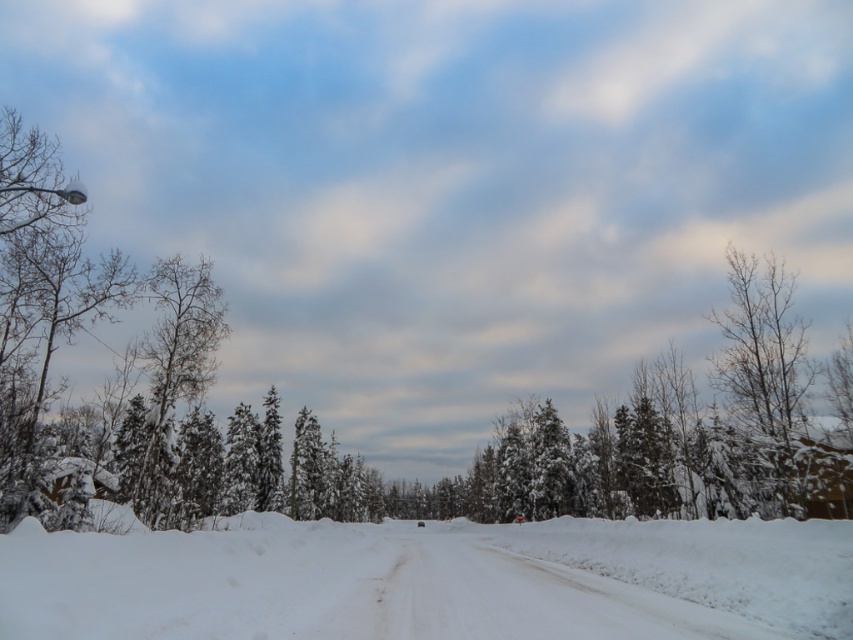
Consider the image. Can you confirm if white fluffy snow at center is positioned to the left of bare branches at right?

Indeed, white fluffy snow at center is positioned on the left side of bare branches at right.

Is white fluffy snow at center behind bare branches at right?

That is False.

This screenshot has width=853, height=640. What do you see at coordinates (432, 579) in the screenshot?
I see `white fluffy snow at center` at bounding box center [432, 579].

This screenshot has width=853, height=640. I want to click on white fluffy snow at center, so click(x=432, y=579).